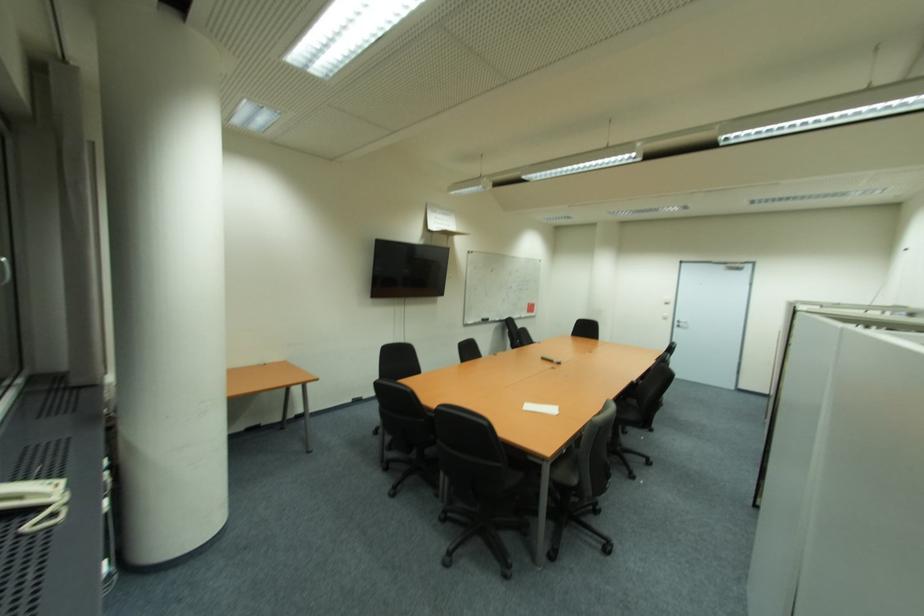
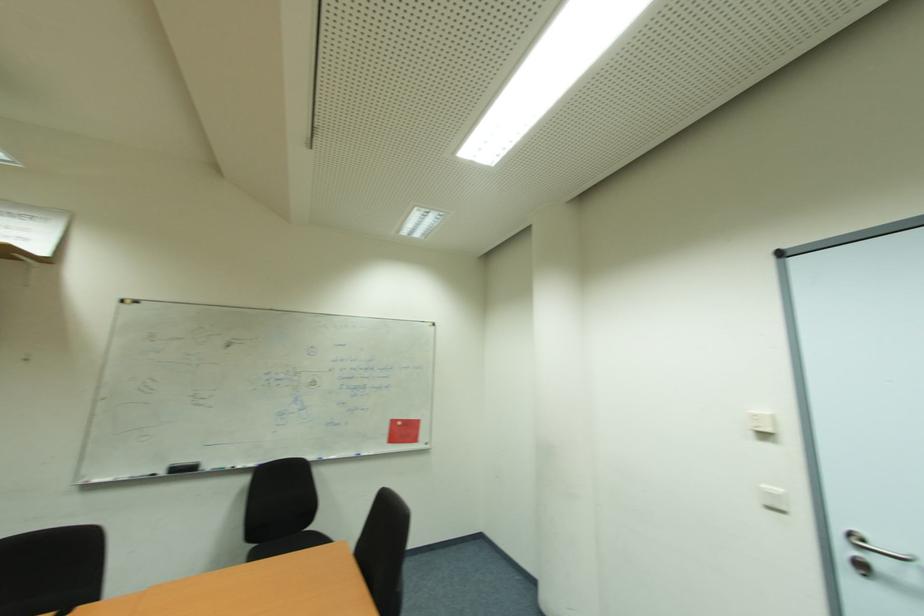
In the second image, find the point that corresponds to (x=684, y=326) in the first image.

(869, 570)